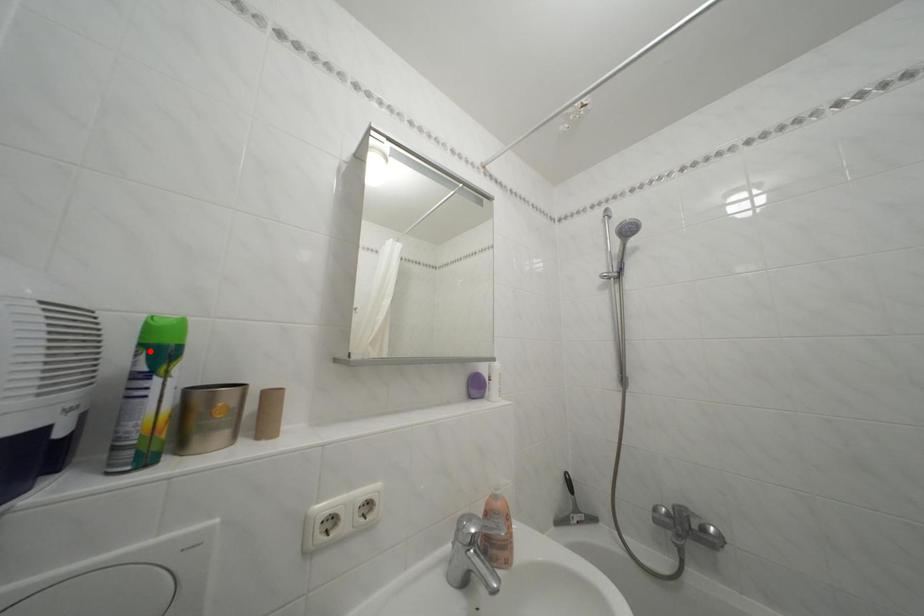
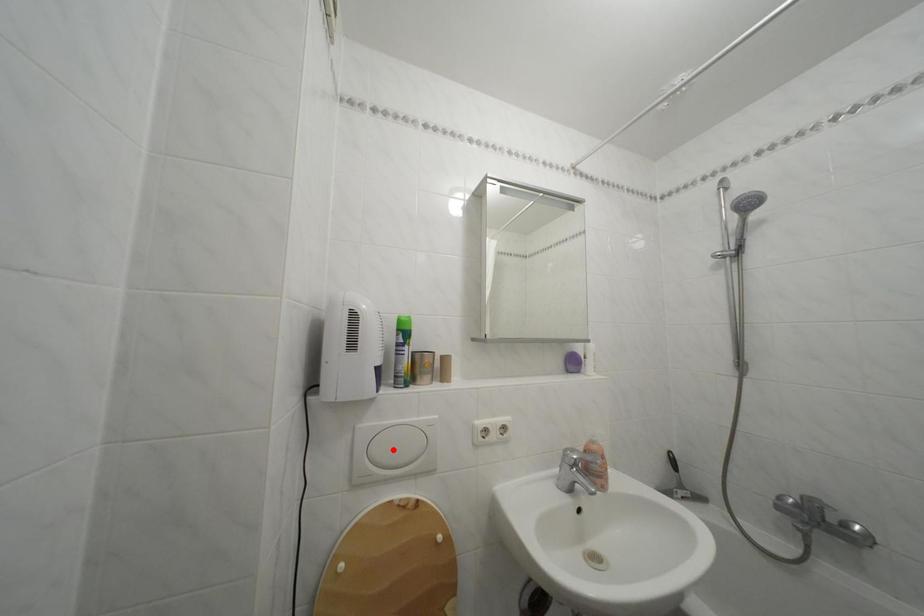
I am providing you with two images of the same scene from different viewpoints. A red point is marked on the first image and another point is marked on the second image. Are the points marked in image1 and image2 representing the same 3D position?

No